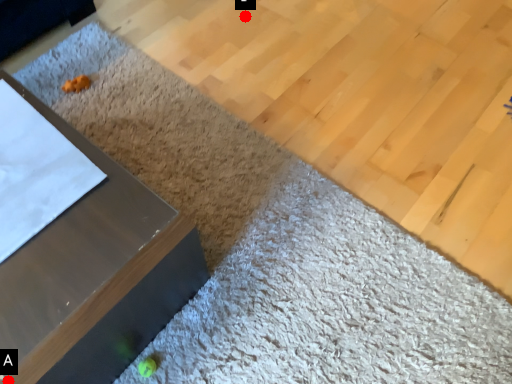
Question: Two points are circled on the image, labeled by A and B beside each circle. Which point is closer to the camera?

Choices:
 (A) A is closer
 (B) B is closer

Answer: (A)